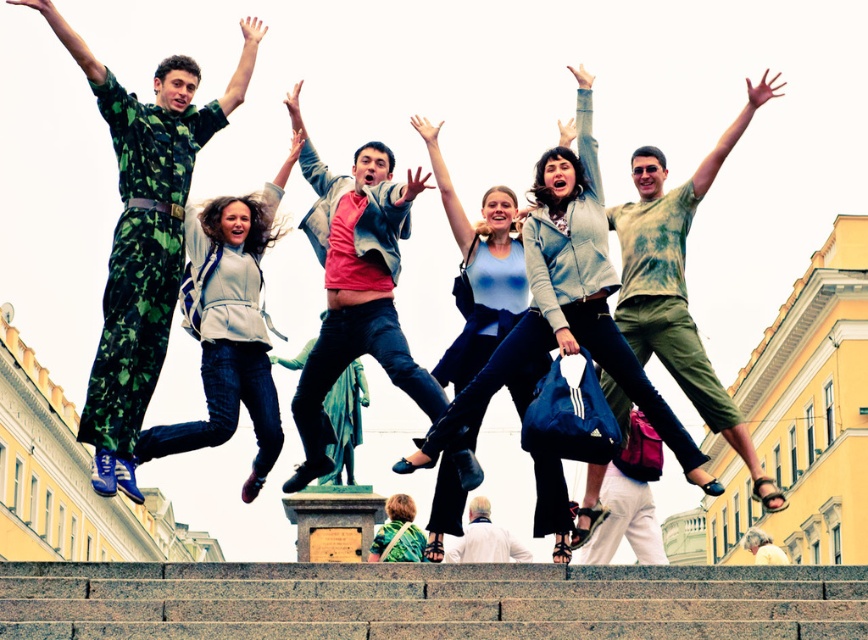
You are a photographer trying to capture the entire group of people jumping on the granite stairs at lower center and the camouflage jumpsuit at left in one frame. Considering the size difference between the two, which object should you focus on first to ensure both are in focus?

The granite stairs at lower center has a smaller size compared to camouflage jumpsuit at left, so you should focus on the camouflage jumpsuit at left first to ensure both are in focus since it is larger and requires more attention to detail.

You are organizing a group photo and need to arrange the camouflage jumpsuit at left and white leather jacket at center based on their sizes. Which should be placed in a position that requires a larger silhouette?

The camouflage jumpsuit at left is bigger than the white leather jacket at center, so it should be placed in the position requiring a larger silhouette.